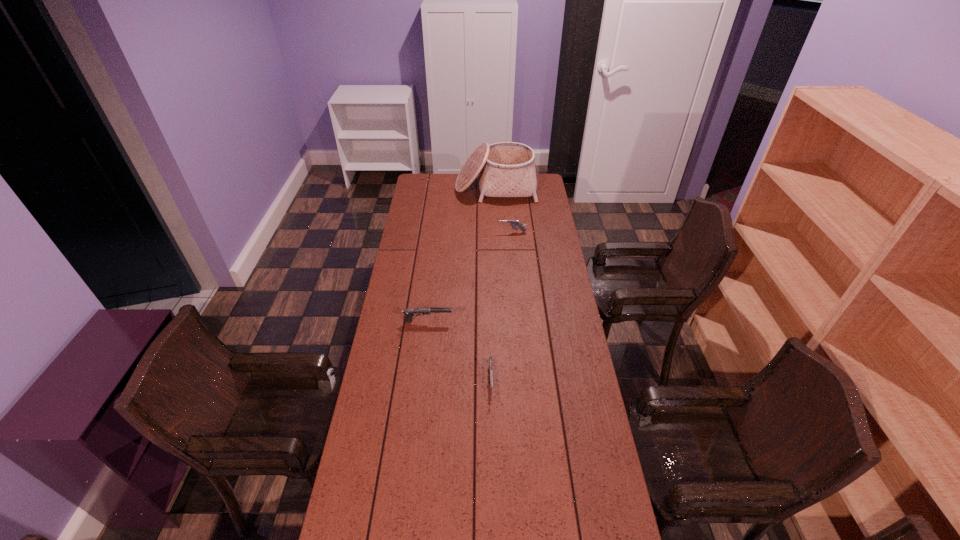
This screenshot has height=540, width=960. I want to click on basket, so click(x=506, y=169).

This screenshot has height=540, width=960. I want to click on the tallest object, so click(506, 169).

Where is `the leftmost gun`? This screenshot has height=540, width=960. the leftmost gun is located at coordinates (410, 312).

The image size is (960, 540). I want to click on the second nearest object, so click(410, 312).

You are a GUI agent. You are given a task and a screenshot of the screen. Output one action in this format:
    pyautogui.click(x=<x>, y=<y>)
    Task: Click on the rightmost gun
    This screenshot has height=540, width=960.
    Given the screenshot: What is the action you would take?
    pyautogui.click(x=514, y=223)

Image resolution: width=960 pixels, height=540 pixels. I want to click on the farthest gun, so click(514, 223).

The image size is (960, 540). What are the coordinates of `the second gun from right to left` in the screenshot? It's located at (490, 358).

What are the coordinates of `the shortest gun` in the screenshot? It's located at (490, 358).

Identify the location of free spot located with the lid open on the basket. The width and height of the screenshot is (960, 540). (496, 213).

At what (x,y) coordinates should I click in order to perform the action: click on blank space located 0.070m at the muzzle end of the second farthest gun. Please return your answer as a coordinate pair (x, y). The width and height of the screenshot is (960, 540). Looking at the image, I should click on (469, 321).